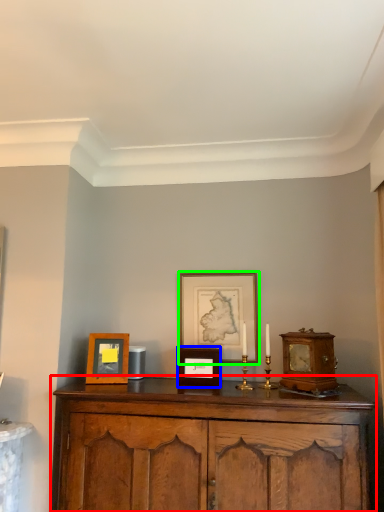
Question: Based on their relative distances, which object is nearer to cabinetry (highlighted by a red box)? Choose from picture frame (highlighted by a blue box) and picture frame (highlighted by a green box).

Choices:
 (A) picture frame
 (B) picture frame

Answer: (A)